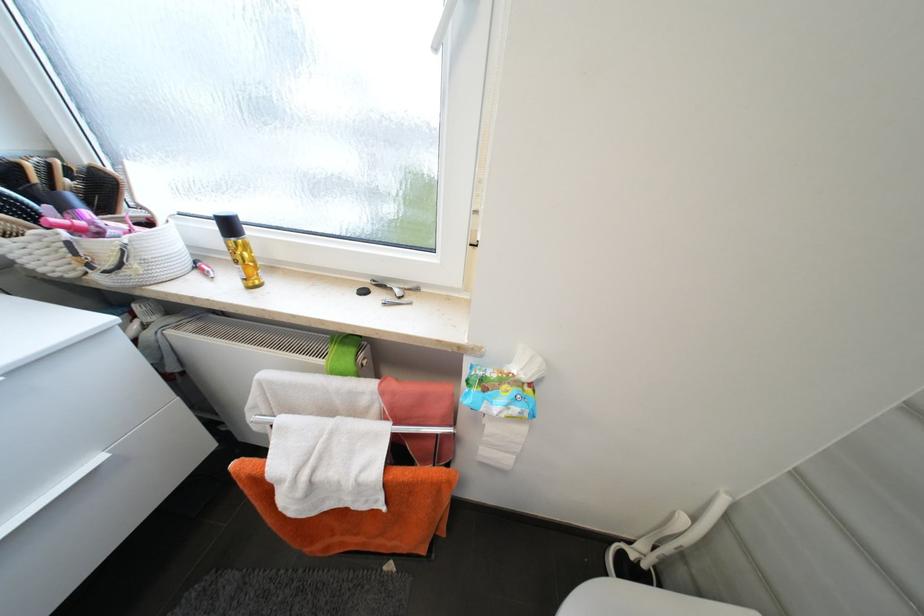
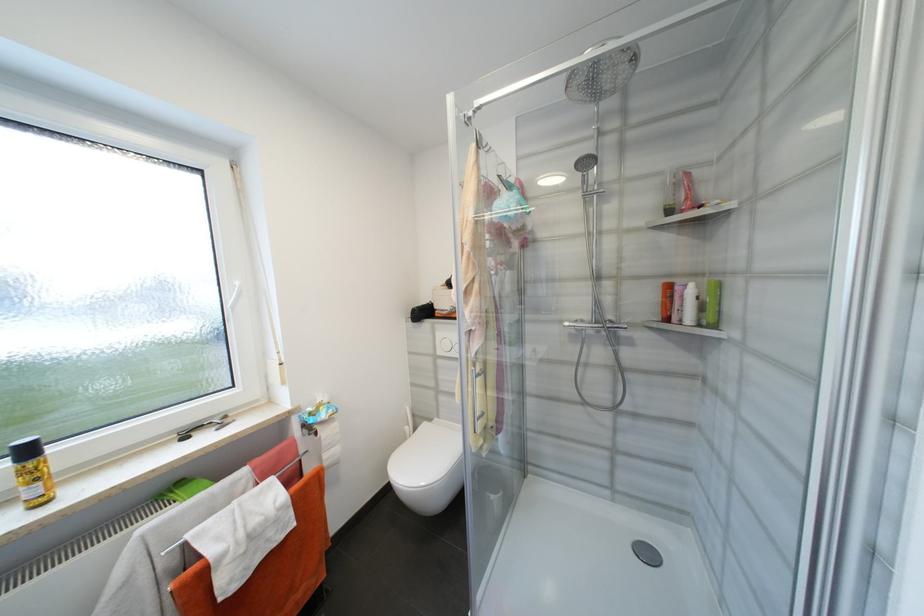
Where in the second image is the point corresponding to (x=235, y=228) from the first image?

(33, 453)